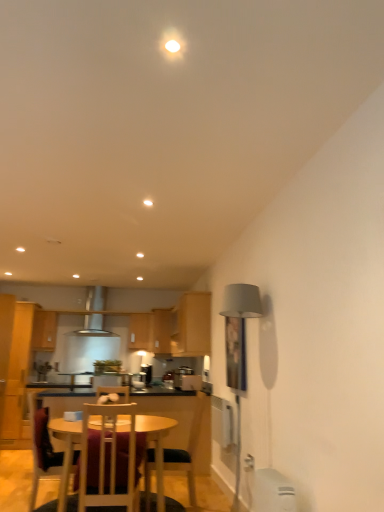
Question: In terms of width, does wooden cabinet at center, which appears as the second cabinetry when viewed from the right, look wider or thinner when compared to wooden cabinet at upper left, the 4th cabinetry from the right?

Choices:
 (A) wide
 (B) thin

Answer: (B)

Question: Is wooden cabinet at center, the 3th cabinetry in the left-to-right sequence, to the left or to the right of wooden cabinet at upper left, marked as the 3th cabinetry in a back-to-front arrangement, in the image?

Choices:
 (A) right
 (B) left

Answer: (A)

Question: Which object is positioned closest to the satin silver exhaust hood at center?

Choices:
 (A) wooden cabinet at upper left, which appears as the 1th cabinetry when viewed from the left
 (B) wooden cabinet at center, the 3th cabinetry from the front
 (C) wooden table at center
 (D) wooden cabinet at center, which appears as the second cabinetry when viewed from the right
 (E) wooden cabinet at center, which is the 1th cabinetry from front to back

Answer: (A)

Question: Based on their relative distances, which object is nearer to the metallic silver toaster at center, which is counted as the second appliance, starting from the back?

Choices:
 (A) wooden cabinet at center, which is the 1th cabinetry from front to back
 (B) wooden cabinet at center, the 3th cabinetry in the left-to-right sequence
 (C) wooden chair at center, marked as the third chair in a left-to-right arrangement
 (D) wooden chair at lower left, the first chair from the left
 (E) wooden cabinet at center, which is the second cabinetry in left-to-right order

Answer: (C)